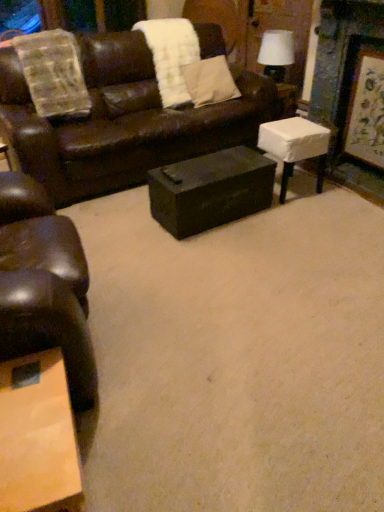
Locate an element on the screen. The image size is (384, 512). unoccupied region to the right of shiny brown leather chair at left is located at coordinates (187, 331).